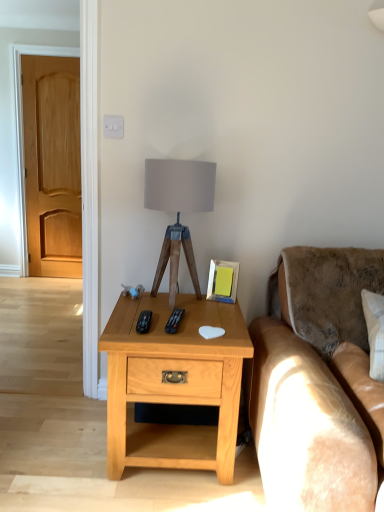
This screenshot has height=512, width=384. Identify the location of free space on the front side of black plastic remote at center, the 1th remote positioned from the right. (179, 335).